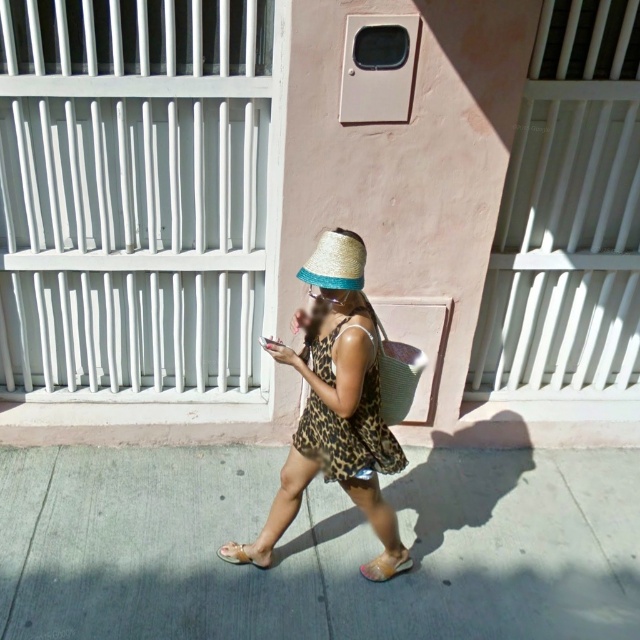
Question: Observing the image, what is the correct spatial positioning of leopard print dress at center in reference to leopard print fabric dress at center?

Choices:
 (A) left
 (B) right

Answer: (B)

Question: Considering the real-world distances, which object is closest to the translucent plastic sandal at lower center?

Choices:
 (A) leopard print fabric dress at center
 (B) gray concrete sidewalk at center
 (C) leopard print dress at center

Answer: (C)

Question: Observing the image, what is the correct spatial positioning of leopard print fabric dress at center in reference to translucent plastic sandal at lower center?

Choices:
 (A) left
 (B) right

Answer: (A)

Question: Which of the following is the farthest from the observer?

Choices:
 (A) (358, 595)
 (B) (332, 241)
 (C) (241, 545)
 (D) (320, 372)

Answer: (C)

Question: Does straw at center have a lesser width compared to beige fabric sandal at lower center?

Choices:
 (A) no
 (B) yes

Answer: (B)

Question: Among these points, which one is nearest to the camera?

Choices:
 (A) (337, 412)
 (B) (374, 458)
 (C) (240, 547)
 (D) (404, 566)

Answer: (A)